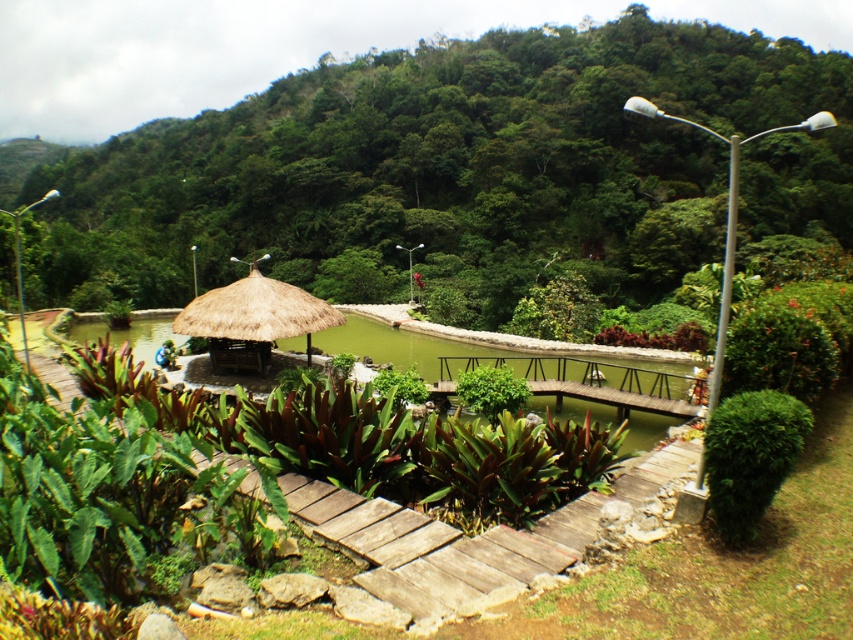
Is green grassy water at center taller than thatched straw umbrella at center?

Correct, green grassy water at center is much taller as thatched straw umbrella at center.

Locate an element on the screen. Image resolution: width=853 pixels, height=640 pixels. green grassy water at center is located at coordinates (403, 342).

Is point (625, 141) positioned behind point (160, 314)?

That is True.

Can you confirm if green leafy plants at center is thinner than green grassy water at center?

Incorrect, green leafy plants at center's width is not less than green grassy water at center's.

At what (x,y) coordinates should I click in order to perform the action: click on green leafy plants at center. Please return your answer as a coordinate pair (x, y). Looking at the image, I should click on (456, 173).

Image resolution: width=853 pixels, height=640 pixels. I want to click on green leafy plants at center, so click(456, 173).

Does green leafy plants at center have a greater width compared to thatched straw umbrella at center?

Indeed, green leafy plants at center has a greater width compared to thatched straw umbrella at center.

Is point (479, 49) farther from camera compared to point (279, 282)?

Yes, point (479, 49) is behind point (279, 282).

Which is behind, point (144, 160) or point (254, 364)?

Point (144, 160)

Image resolution: width=853 pixels, height=640 pixels. Identify the location of green leafy plants at center. (456, 173).